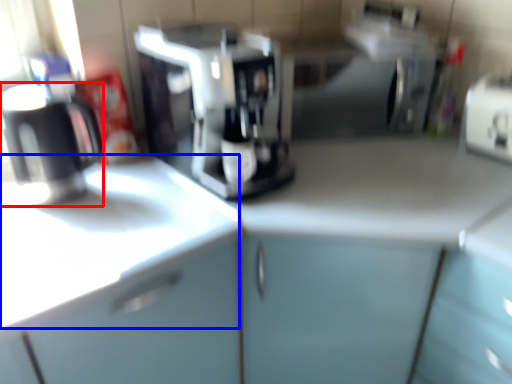
Question: Which object is further to the camera taking this photo, kitchen appliance (highlighted by a red box) or counter top (highlighted by a blue box)?

Choices:
 (A) kitchen appliance
 (B) counter top

Answer: (A)